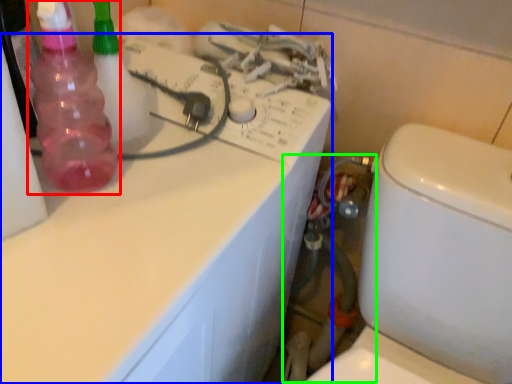
Question: Which object is the farthest from bottle (highlighted by a red box)? Choose among these: counter top (highlighted by a blue box) or water pipe (highlighted by a green box).

Choices:
 (A) counter top
 (B) water pipe

Answer: (B)